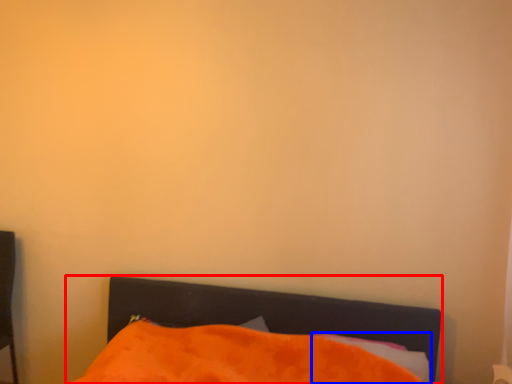
Question: Which object appears farthest to the camera in this image, bed (highlighted by a red box) or pillow (highlighted by a blue box)?

Choices:
 (A) bed
 (B) pillow

Answer: (B)